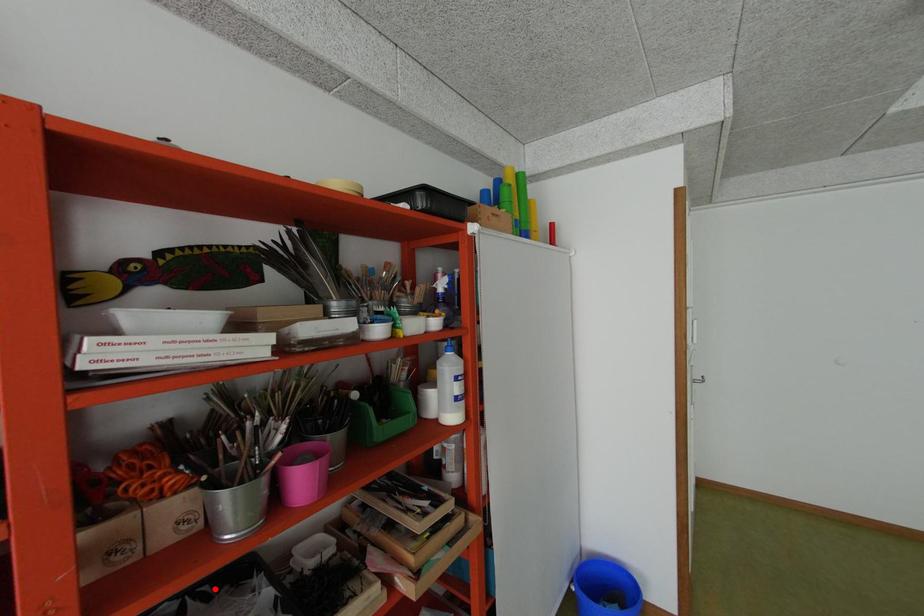
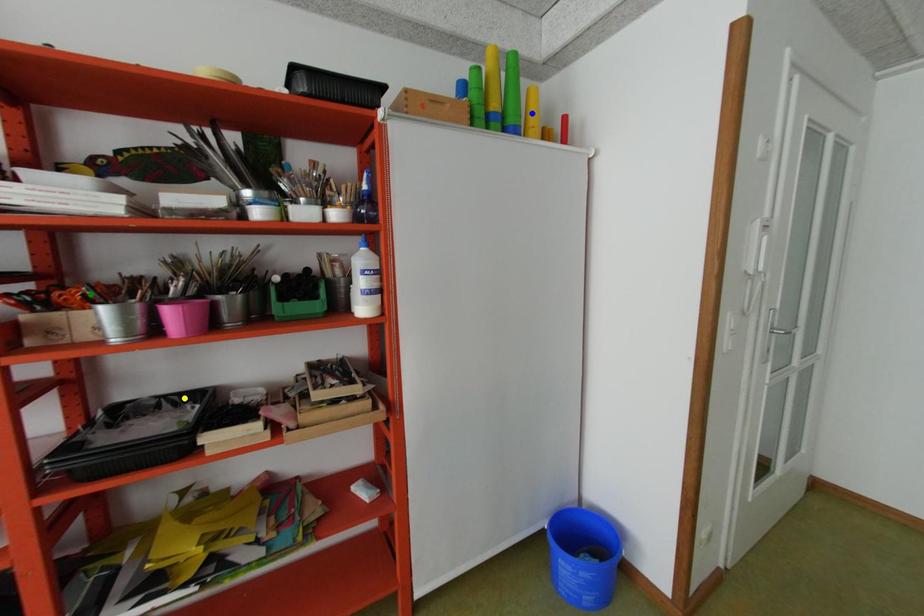
Question: I am providing you with two images of the same scene from different viewpoints. A red point is marked on the first image. You are given multiple points on the second image. Which point in image 2 is actually the same real-world point as the red point in image 1?

Choices:
 (A) yellow point
 (B) green point
 (C) blue point

Answer: (A)